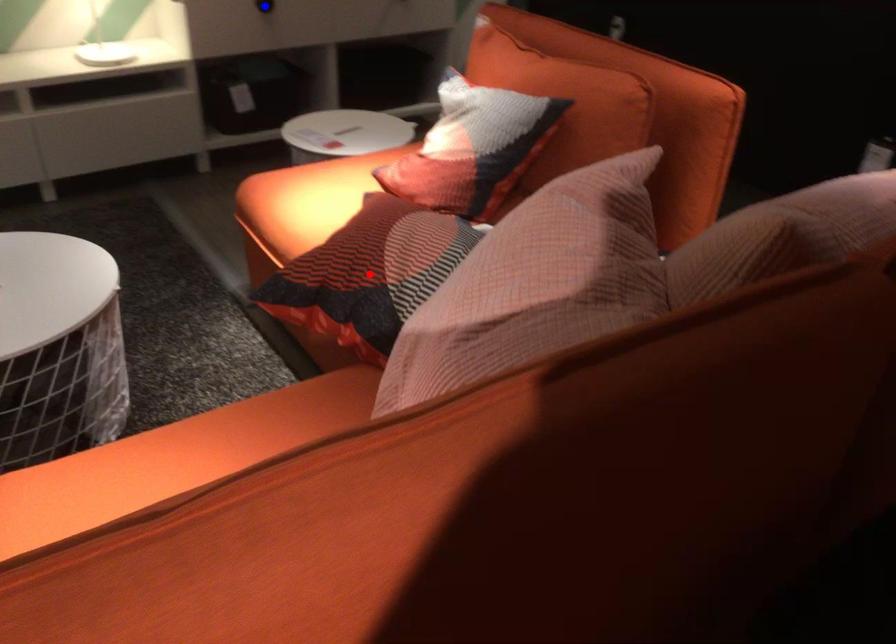
Question: In the image, two points are highlighted. Which point is nearer to the camera? Reply with the corresponding letter.

Choices:
 (A) blue point
 (B) red point

Answer: (B)